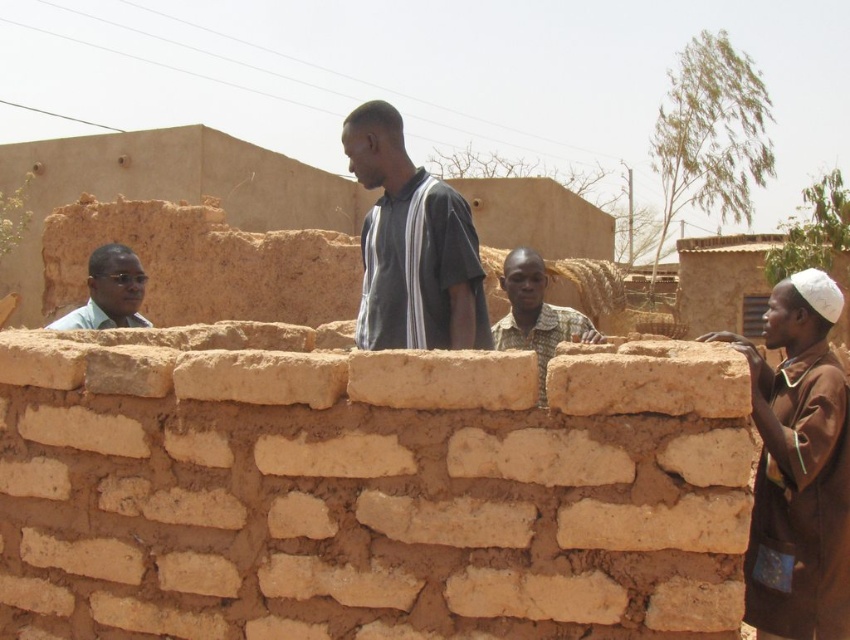
Can you confirm if brown clay brick at center is shorter than matte green shirt at upper left?

Yes.

Is brown clay brick at center smaller than matte green shirt at upper left?

No, brown clay brick at center is not smaller than matte green shirt at upper left.

Does point (697, 372) come farther from viewer compared to point (112, 320)?

No, (697, 372) is closer to viewer.

This screenshot has width=850, height=640. Find the location of `brown clay brick at center`. brown clay brick at center is located at coordinates (650, 380).

Which is behind, point (615, 397) or point (506, 253)?

Point (506, 253)

Identify the location of brown clay brick at center. This screenshot has height=640, width=850. (650, 380).

The width and height of the screenshot is (850, 640). What do you see at coordinates (412, 244) in the screenshot?
I see `dark gray striped shirt at center` at bounding box center [412, 244].

Can you confirm if dark gray striped shirt at center is bigger than brown clay brick at center?

Actually, dark gray striped shirt at center might be smaller than brown clay brick at center.

Locate an element on the screen. dark gray striped shirt at center is located at coordinates (412, 244).